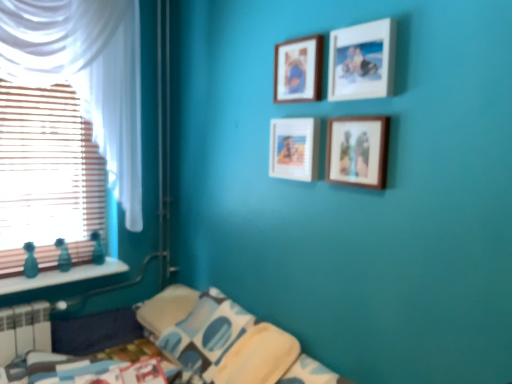
Question: Is there a large distance between wooden picture frame at upper center, the third picture frame in the bottom-to-top sequence, and wooden frame at center, which is counted as the 4th picture frame, starting from the top?

Choices:
 (A) yes
 (B) no

Answer: (B)

Question: Is the depth of wooden picture frame at upper center, the second picture frame viewed from the top, less than that of wooden frame at center, which is counted as the 4th picture frame, starting from the top?

Choices:
 (A) no
 (B) yes

Answer: (B)

Question: Is the depth of wooden picture frame at upper center, the third picture frame in the bottom-to-top sequence, greater than that of wooden frame at center, which is counted as the 4th picture frame, starting from the top?

Choices:
 (A) no
 (B) yes

Answer: (A)

Question: Is wooden picture frame at upper center, the second picture frame viewed from the top, directly adjacent to wooden frame at center, which is counted as the 4th picture frame, starting from the top?

Choices:
 (A) no
 (B) yes

Answer: (A)

Question: From the image's perspective, is wooden picture frame at upper center, the third picture frame in the bottom-to-top sequence, below wooden frame at center, which is counted as the 4th picture frame, starting from the top?

Choices:
 (A) no
 (B) yes

Answer: (A)

Question: Can you confirm if wooden picture frame at upper center, the second picture frame viewed from the top, is positioned to the left of wooden frame at center, which is counted as the 4th picture frame, starting from the top?

Choices:
 (A) no
 (B) yes

Answer: (A)

Question: From the image's perspective, is wooden blinds at left located above wooden picture frame at upper center, which is the first picture frame in top-to-bottom order?

Choices:
 (A) yes
 (B) no

Answer: (B)

Question: Is wooden blinds at left oriented away from wooden picture frame at upper center, which is the first picture frame in top-to-bottom order?

Choices:
 (A) no
 (B) yes

Answer: (A)

Question: Considering the relative sizes of wooden blinds at left and wooden picture frame at upper center, placed as the 4th picture frame when sorted from bottom to top, in the image provided, is wooden blinds at left taller than wooden picture frame at upper center, placed as the 4th picture frame when sorted from bottom to top,?

Choices:
 (A) no
 (B) yes

Answer: (B)

Question: From the image's perspective, is wooden blinds at left under wooden picture frame at upper center, which is the first picture frame in top-to-bottom order?

Choices:
 (A) no
 (B) yes

Answer: (B)

Question: Can you confirm if wooden blinds at left is positioned to the right of wooden picture frame at upper center, placed as the 4th picture frame when sorted from bottom to top?

Choices:
 (A) no
 (B) yes

Answer: (A)

Question: From a real-world perspective, is wooden blinds at left on wooden picture frame at upper center, placed as the 4th picture frame when sorted from bottom to top?

Choices:
 (A) yes
 (B) no

Answer: (B)

Question: Does wooden picture frame at upper center, the third picture frame in the bottom-to-top sequence, come in front of teal glass bottles at left?

Choices:
 (A) yes
 (B) no

Answer: (A)